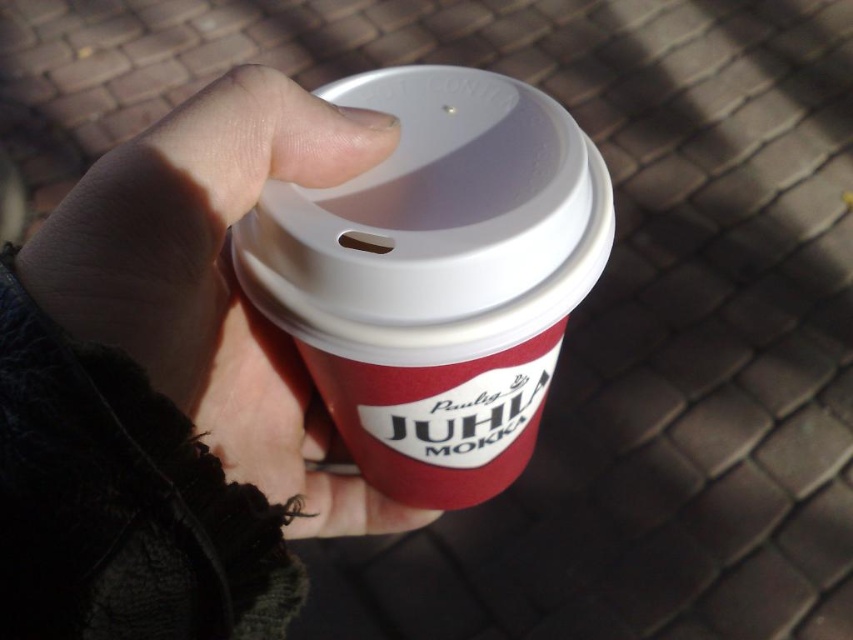
You are a barista trying to place the matte plastic cup at center and the smooth leather glove at center onto a shelf. The shelf has a height limit of 10 cm. Can both items be placed on the shelf without exceeding the height limit?

The matte plastic cup at center is taller than the smooth leather glove at center. Since the shelf has a height limit of 10 cm, both items can be placed on the shelf only if the cup is within the limit. However, the description does not provide specific height measurements, so it is impossible to determine if they fit based on the given information.

You are trying to place the matte plastic cup at center into a rectangular box that is exactly the same width as the smooth leather glove at center. Will the cup fit inside the box?

The matte plastic cup at center is wider than the smooth leather glove at center, so the cup will not fit inside the box that matches the glove width.

You are trying to grab the matte plastic cup at center and the smooth leather glove at center from the scene. Which object is closer to your hand when you reach out?

The matte plastic cup at center is closer to your hand because it is positioned further to the viewer than the smooth leather glove at center.